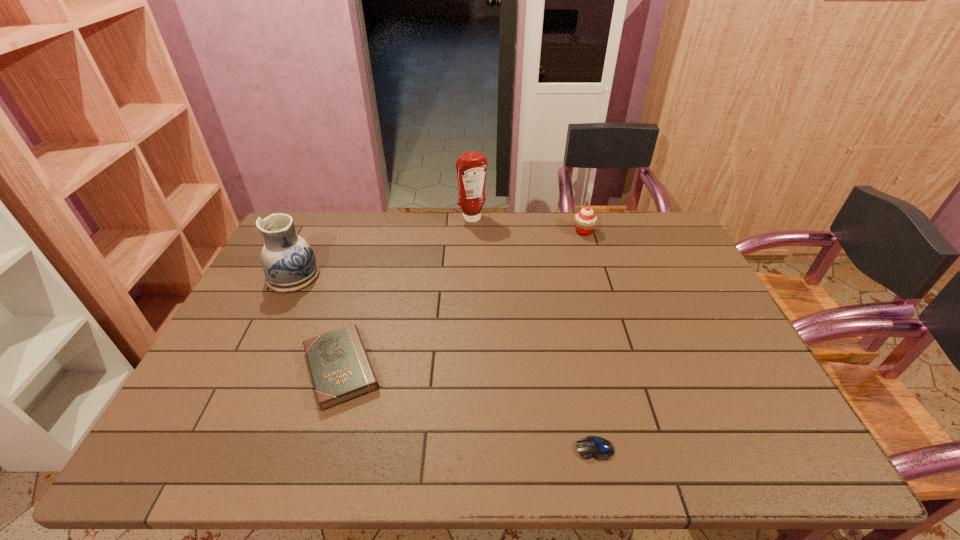
Where is `blank space that satisfies the following two spatial constraints: 1. on the back side of the second nearest object; 2. on the right side of the third object from left to right`? The image size is (960, 540). blank space that satisfies the following two spatial constraints: 1. on the back side of the second nearest object; 2. on the right side of the third object from left to right is located at coordinates (385, 219).